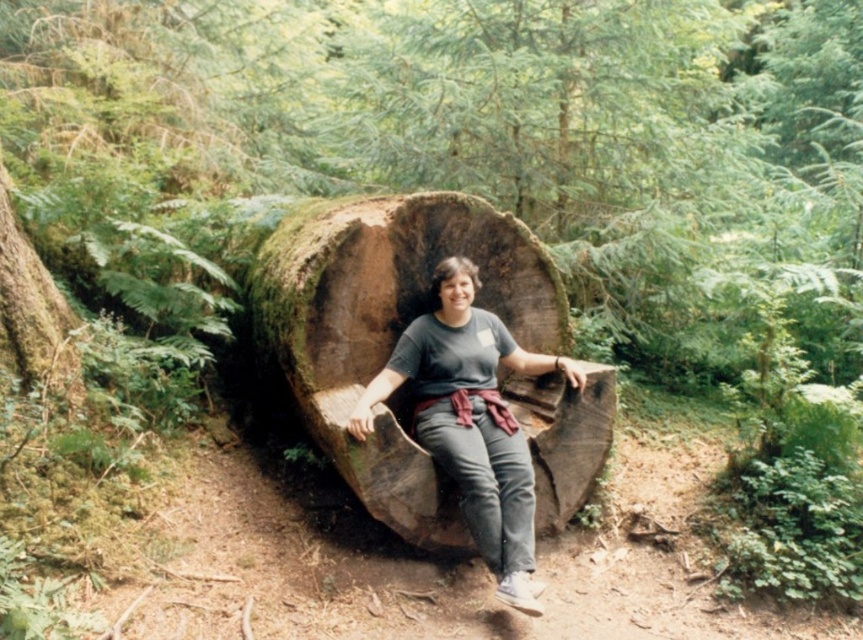
Is matte gray shirt at center positioned in front of green mossy log at left?

Yes, matte gray shirt at center is closer to the viewer.

Does matte gray shirt at center have a larger size compared to green mossy log at left?

Indeed, matte gray shirt at center has a larger size compared to green mossy log at left.

Locate an element on the screen. matte gray shirt at center is located at coordinates (471, 420).